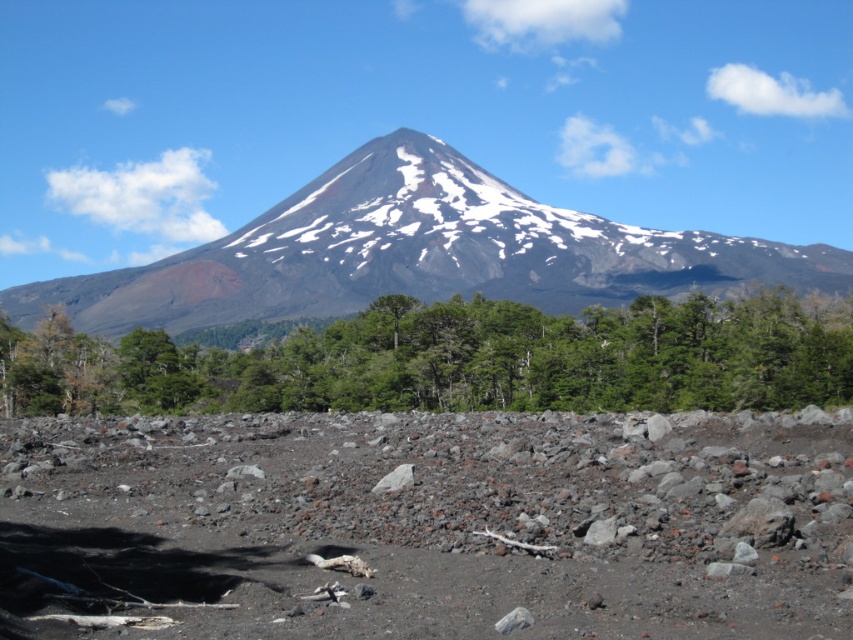
Question: Can you confirm if green leafy trees at center is positioned to the left of snowy volcanic peak at center?

Choices:
 (A) no
 (B) yes

Answer: (B)

Question: Does green leafy trees at center have a smaller size compared to snowy volcanic peak at center?

Choices:
 (A) no
 (B) yes

Answer: (B)

Question: Which point is farther from the camera taking this photo?

Choices:
 (A) (221, 372)
 (B) (169, 276)

Answer: (B)

Question: From the image, what is the correct spatial relationship of green leafy trees at center in relation to snowy volcanic peak at center?

Choices:
 (A) right
 (B) left

Answer: (B)

Question: Which of the following is the farthest from the observer?

Choices:
 (A) snowy volcanic peak at center
 (B) green leafy trees at center

Answer: (A)